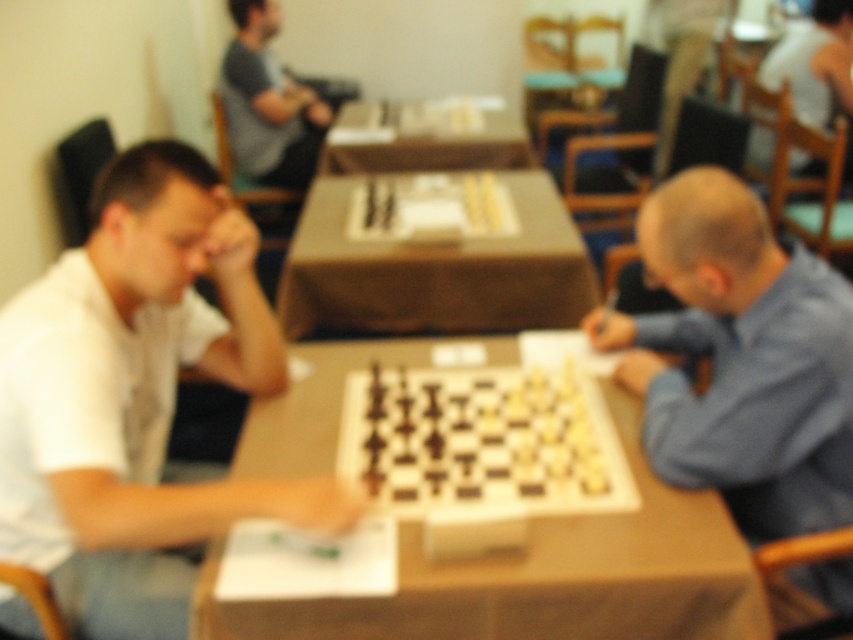
Which is in front, point (341, 305) or point (476, 145)?

Positioned in front is point (341, 305).

Does brown fabric table at center have a lesser height compared to brown wooden table at center?

Incorrect, brown fabric table at center's height does not fall short of brown wooden table at center's.

Find the location of a particular element. This screenshot has width=853, height=640. brown fabric table at center is located at coordinates (434, 272).

Is white matte shirt at left further to the viewer compared to brown wooden table at center?

No, it is in front of brown wooden table at center.

Does point (93, 428) come closer to viewer compared to point (364, 140)?

Yes.

Who is more distant from viewer, (18, 349) or (351, 166)?

Positioned behind is point (351, 166).

You are a GUI agent. You are given a task and a screenshot of the screen. Output one action in this format:
    pyautogui.click(x=<x>, y=<y>)
    Task: Click on the white matte shirt at left
    The width and height of the screenshot is (853, 640).
    Given the screenshot: What is the action you would take?
    pyautogui.click(x=136, y=396)

Is point (752, 352) closer to camera compared to point (274, 72)?

That is True.

Is blue fabric shirt at right to the left of gray fabric shirt at upper center from the viewer's perspective?

In fact, blue fabric shirt at right is to the right of gray fabric shirt at upper center.

Is point (741, 362) farther from camera compared to point (283, 179)?

No, it is in front of (283, 179).

Locate an element on the screen. The image size is (853, 640). blue fabric shirt at right is located at coordinates (740, 358).